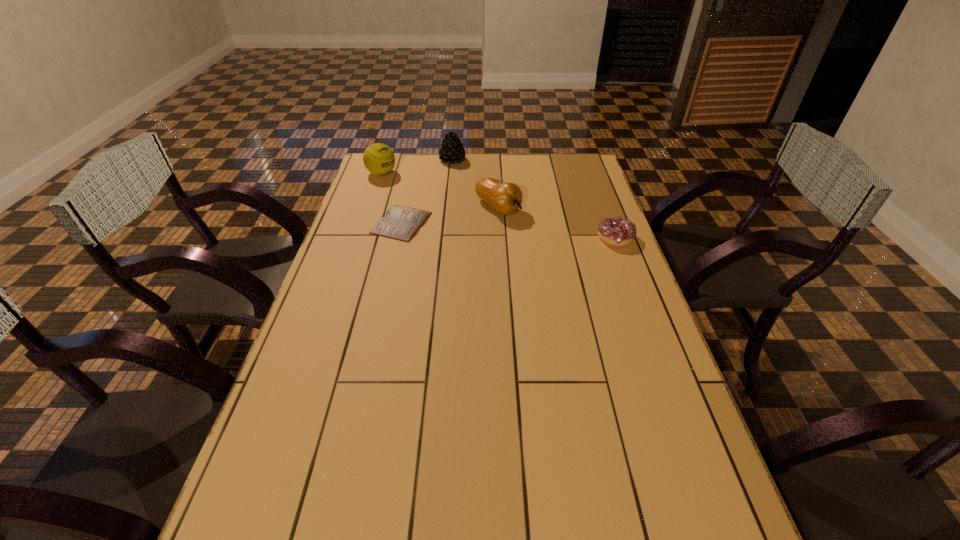
Locate an element on the screen. This screenshot has height=540, width=960. empty location between the softball and the diary is located at coordinates (392, 198).

Where is `vacant area that lies between the softball and the fourth object from left to right`? vacant area that lies between the softball and the fourth object from left to right is located at coordinates (440, 190).

Identify the location of empty space between the softball and the second object from right to left. (440, 190).

The height and width of the screenshot is (540, 960). What are the coordinates of `free space between the pinecone and the softball` in the screenshot? It's located at (417, 167).

Where is `vacant area that lies between the diary and the fourth object from left to right`? Image resolution: width=960 pixels, height=540 pixels. vacant area that lies between the diary and the fourth object from left to right is located at coordinates (450, 215).

Locate an element on the screen. The width and height of the screenshot is (960, 540). unoccupied position between the doughnut and the gourd is located at coordinates (557, 222).

At what (x,y) coordinates should I click in order to perform the action: click on vacant area between the gourd and the pinecone. Please return your answer as a coordinate pair (x, y). Looking at the image, I should click on (475, 184).

This screenshot has width=960, height=540. What are the coordinates of `vacant space that is in between the gourd and the doughnut` in the screenshot? It's located at (557, 222).

Identify which object is located as the nearest to the fourth object from left to right. Please provide its 2D coordinates. Your answer should be formatted as a tuple, i.e. [(x, y)], where the tuple contains the x and y coordinates of a point satisfying the conditions above.

[(400, 223)]

This screenshot has width=960, height=540. In order to click on object that stands as the closest to the fourth object from left to right in this screenshot , I will do `click(400, 223)`.